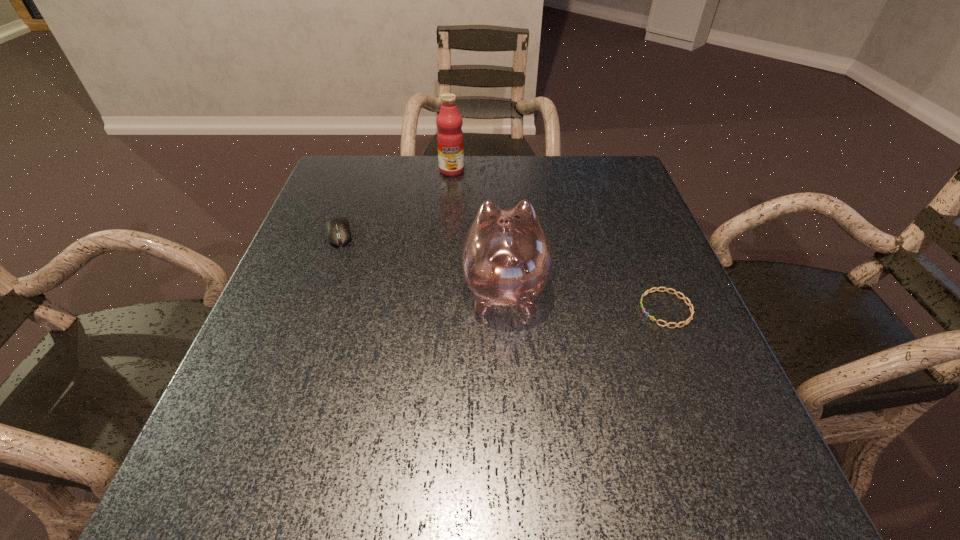
Choose which object is the second nearest neighbor to the computer equipment. Please provide its 2D coordinates. Your answer should be formatted as a tuple, i.e. [(x, y)], where the tuple contains the x and y coordinates of a point satisfying the conditions above.

[(450, 141)]